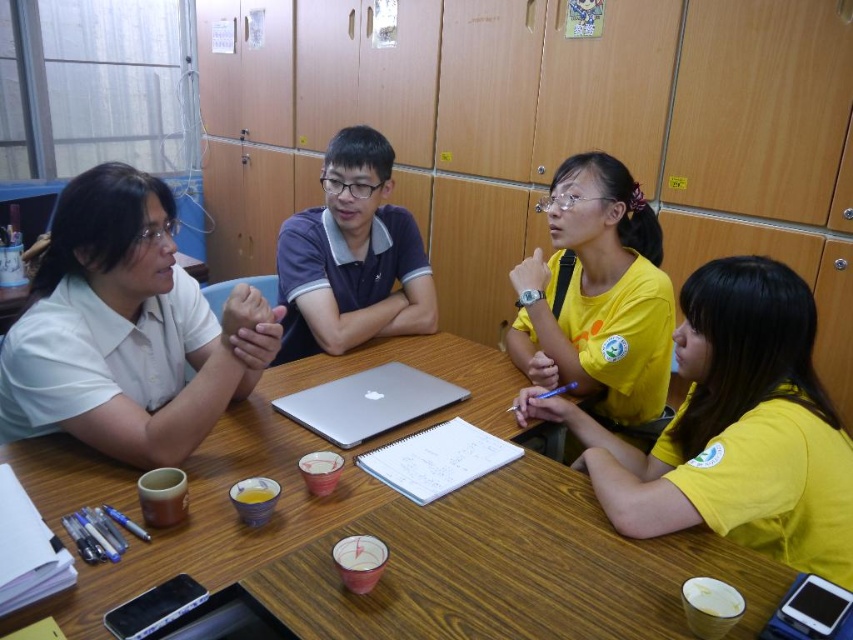
Question: Which is farther from the dark blue polo shirt at center?

Choices:
 (A) sleek silver laptop at center
 (B) yellow matte shirt at upper right
 (C) yellow matte shirt at center

Answer: (B)

Question: Considering the relative positions of dark blue polo shirt at center and sleek silver laptop at center in the image provided, where is dark blue polo shirt at center located with respect to sleek silver laptop at center?

Choices:
 (A) right
 (B) left

Answer: (B)

Question: Which object is closer to the camera taking this photo?

Choices:
 (A) wooden table at center
 (B) yellow matte shirt at center
 (C) sleek silver laptop at center

Answer: (A)

Question: Estimate the real-world distances between objects in this image. Which object is closer to the wooden table at center?

Choices:
 (A) white matte shirt at upper left
 (B) dark blue polo shirt at center
 (C) yellow matte shirt at upper right

Answer: (C)

Question: Observing the image, what is the correct spatial positioning of yellow matte shirt at upper right in reference to dark blue polo shirt at center?

Choices:
 (A) left
 (B) right

Answer: (B)

Question: Does yellow matte shirt at upper right appear on the left side of dark blue polo shirt at center?

Choices:
 (A) no
 (B) yes

Answer: (A)